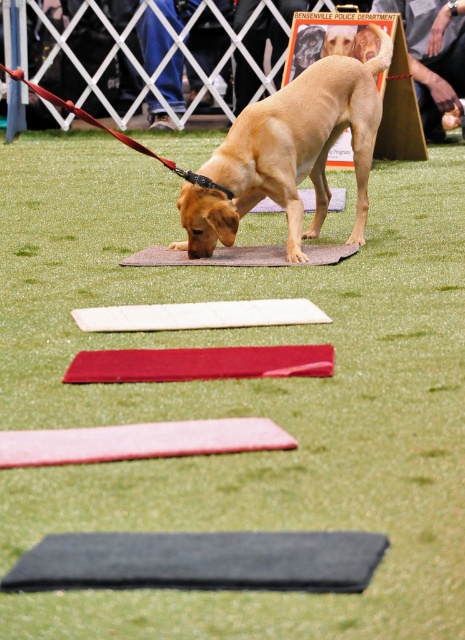
Question: Which point is closer to the camera?

Choices:
 (A) pyautogui.click(x=325, y=188)
 (B) pyautogui.click(x=445, y=106)

Answer: (A)

Question: Can you confirm if golden fur dog at center is positioned above smooth wooden board at upper center?

Choices:
 (A) yes
 (B) no

Answer: (B)

Question: Does golden fur dog at center have a smaller size compared to smooth wooden board at upper center?

Choices:
 (A) no
 (B) yes

Answer: (B)

Question: Which point appears closest to the camera in this image?

Choices:
 (A) (313, 132)
 (B) (446, 99)

Answer: (A)

Question: Which point appears farthest from the camera in this image?

Choices:
 (A) (463, 74)
 (B) (321, 188)

Answer: (A)

Question: Does golden fur dog at center lie in front of smooth wooden board at upper center?

Choices:
 (A) no
 (B) yes

Answer: (B)